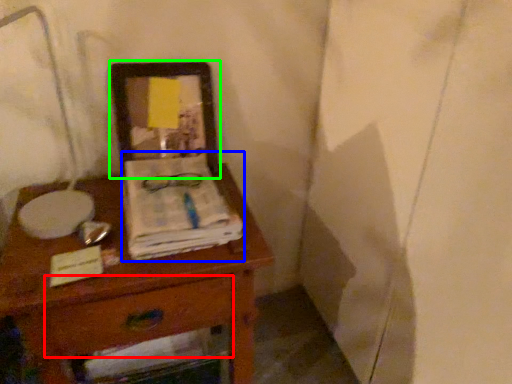
Question: Which object is the farthest from drawer (highlighted by a red box)? Choose among these: magazine (highlighted by a blue box) or picture frame (highlighted by a green box).

Choices:
 (A) magazine
 (B) picture frame

Answer: (B)